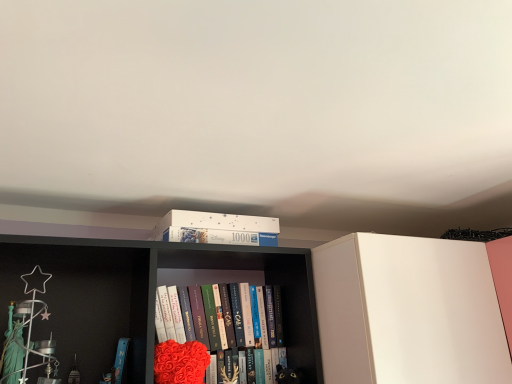
Image resolution: width=512 pixels, height=384 pixels. I want to click on vacant point above white matte puzzle box at upper center (from a real-world perspective), so click(x=159, y=254).